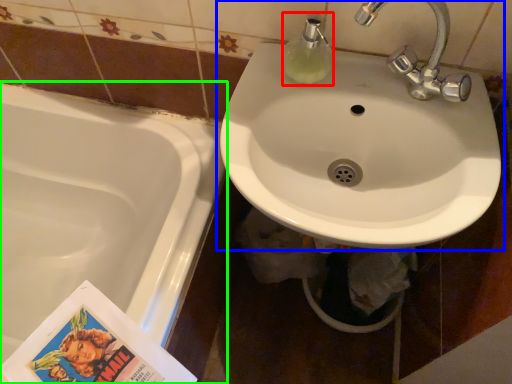
Question: Which object is positioned farthest from soap dispenser (highlighted by a red box)? Select from sink (highlighted by a blue box) and bathtub (highlighted by a green box).

Choices:
 (A) sink
 (B) bathtub

Answer: (B)